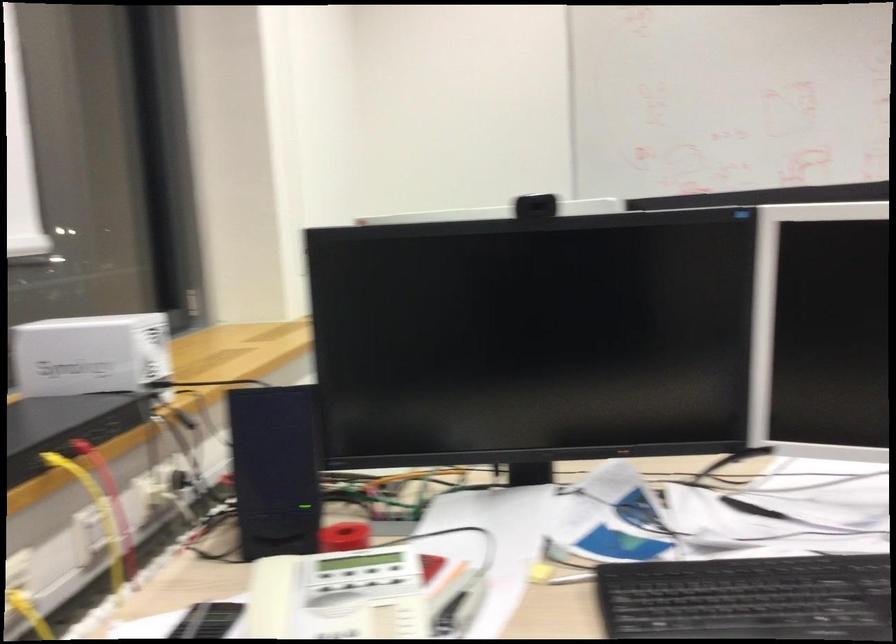
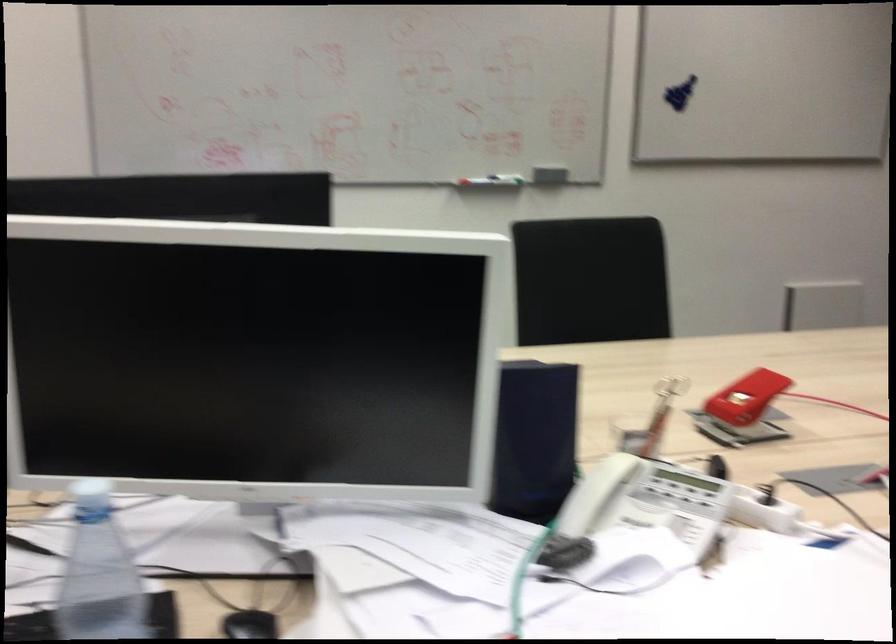
Question: The camera is either moving clockwise (left) or counter-clockwise (right) around the object. The first image is from the beginning of the video and the second image is from the end. Is the camera moving left or right when shooting the video?

Choices:
 (A) Left
 (B) Right

Answer: (A)